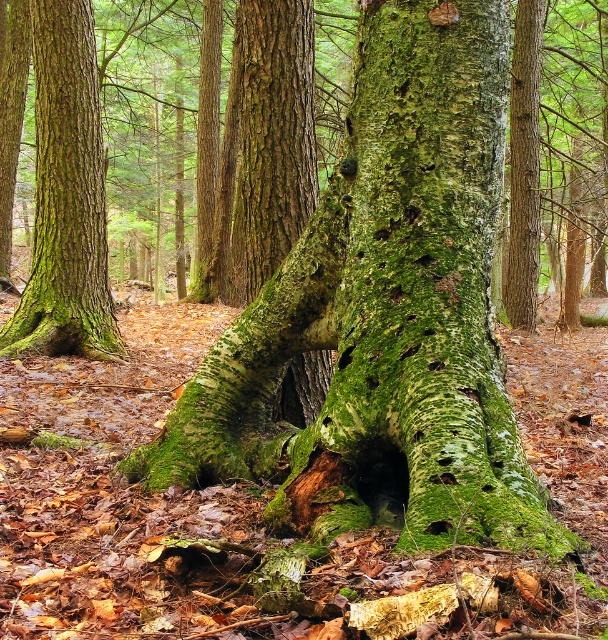
Does point (67, 163) come behind point (295, 163)?

That is True.

Does green mossy tree trunk at left have a larger size compared to green mossy tree trunk at center?

Yes.

Which is behind, point (58, 333) or point (244, 99)?

The point (58, 333) is behind.

The height and width of the screenshot is (640, 608). What are the coordinates of `green mossy tree trunk at left` in the screenshot? It's located at (66, 196).